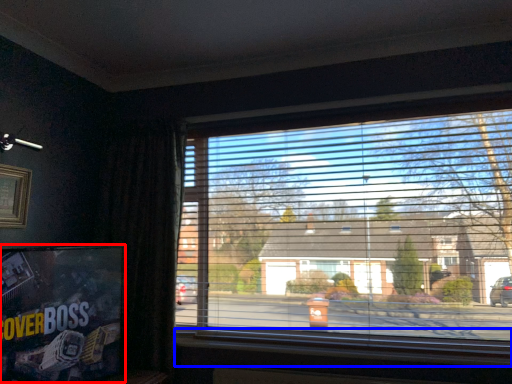
Question: Which of the following is the closest to the observer, tv show (highlighted by a red box) or window sill (highlighted by a blue box)?

Choices:
 (A) tv show
 (B) window sill

Answer: (A)